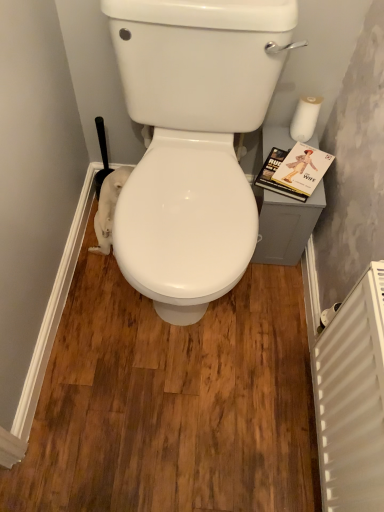
What are the coordinates of `free space in front of white matte toilet paper at lower right, the 1th toilet paper in the left-to-right sequence` in the screenshot? It's located at (105, 278).